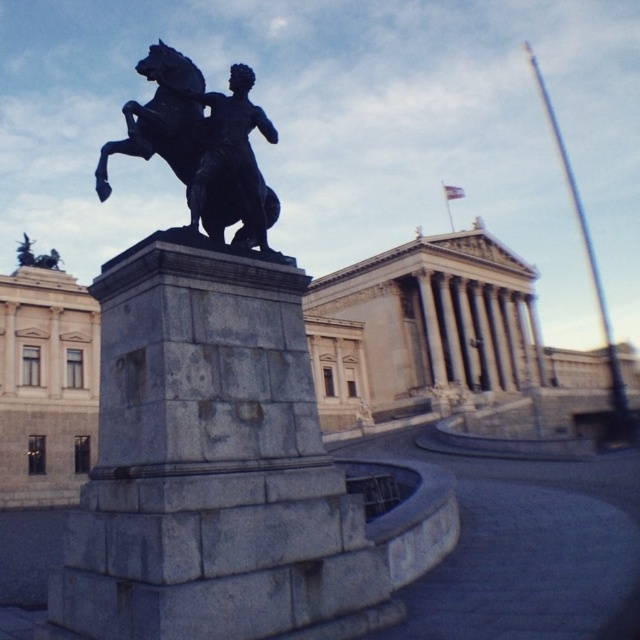
You are an art student analyzing the classical architectural setting. You observe the polished bronze statue at center and the polished bronze horse at center. Which object has a greater width?

The polished bronze statue at center has a greater width than the polished bronze horse at center according to the description.

You are an art student analyzing the statue and its components. Based on the scene, which object is wider between the black polished stone statue at center and the polished bronze horse at center?

The black polished stone statue at center is wider than the polished bronze horse at center according to the description.

You are standing at the center of the image. Which direction should you move to reach the black polished stone statue at center?

Since the black polished stone statue at center is located at point coordinates of (209, 413), you should move to the right and slightly downward from the center to reach it.